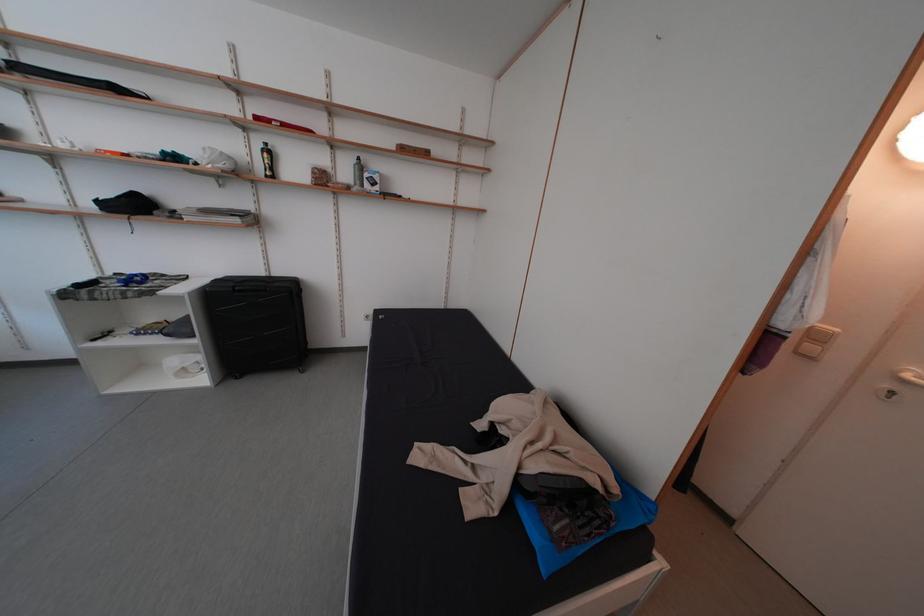
Where would you pull the white door handle? Please return your answer as a coordinate pair (x, y).

(910, 379)